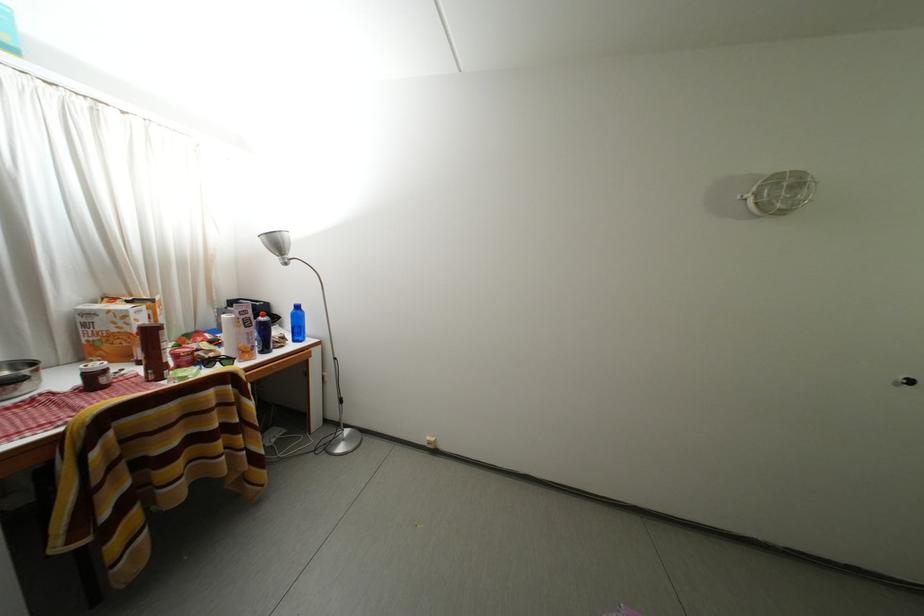
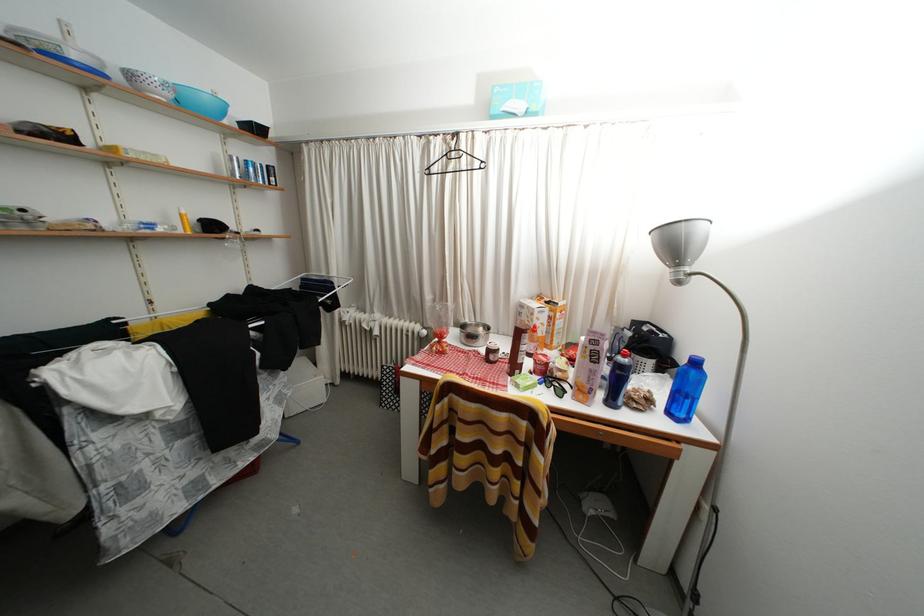
Where in the second image is the point corresponding to point (101, 381) from the first image?

(496, 357)